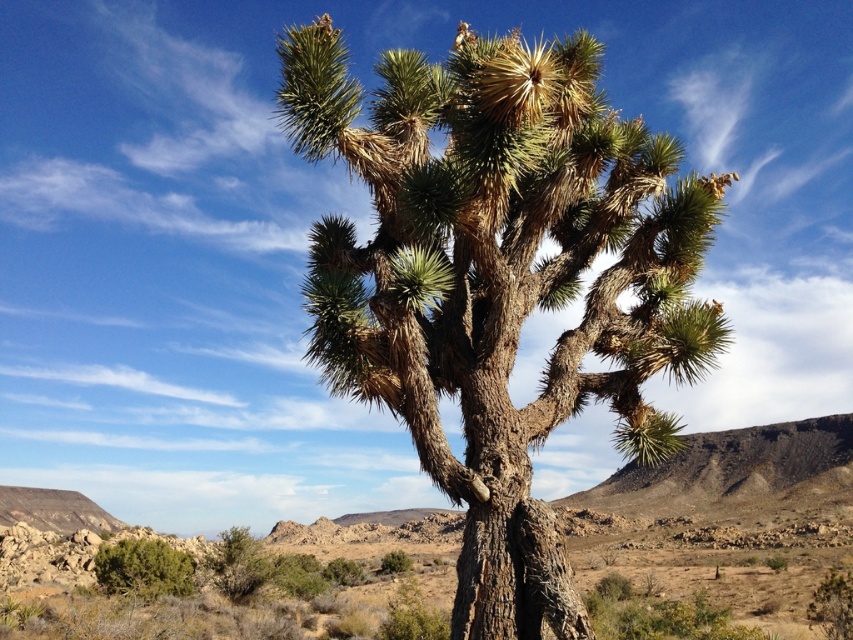
Question: Can you confirm if brown rough desert at center is positioned to the right of green leafy bush at lower left?

Choices:
 (A) yes
 (B) no

Answer: (A)

Question: Can you confirm if brown rough desert at center is wider than green spiky bush at lower left?

Choices:
 (A) no
 (B) yes

Answer: (B)

Question: Estimate the real-world distances between objects in this image. Which object is farther from the brown rough desert at center?

Choices:
 (A) green spiny tree at center
 (B) green leafy bush at lower left
 (C) green spiky bush at lower left

Answer: (A)

Question: Among these objects, which one is farthest from the camera?

Choices:
 (A) brown rough desert at center
 (B) green spiky bush at lower left

Answer: (A)

Question: Which of the following is the closest to the observer?

Choices:
 (A) (125, 552)
 (B) (338, 371)
 (C) (556, 513)
 (D) (236, 588)

Answer: (B)

Question: Observing the image, what is the correct spatial positioning of green spiny tree at center in reference to green spiky bush at lower left?

Choices:
 (A) right
 (B) left

Answer: (A)